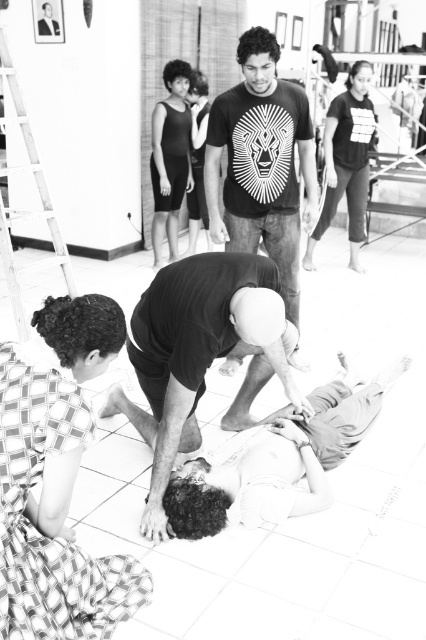
Who is positioned more to the left, checkered fabric at lower left or matte black t-shirt at center?

checkered fabric at lower left

Locate an element on the screen. checkered fabric at lower left is located at coordinates (57, 483).

Does matte black t-shirt at center have a greater height compared to dark gray t-shirt at upper right?

Correct, matte black t-shirt at center is much taller as dark gray t-shirt at upper right.

Who is positioned more to the right, matte black t-shirt at center or dark gray t-shirt at upper right?

Positioned to the right is dark gray t-shirt at upper right.

I want to click on matte black t-shirt at center, so click(261, 163).

Is checkered fabric at lower left behind smooth skin person at lower center?

No, it is in front of smooth skin person at lower center.

Does checkered fabric at lower left have a lesser height compared to smooth skin person at lower center?

No.

Does point (85, 294) lie behind point (252, 472)?

No.

You are a GUI agent. You are given a task and a screenshot of the screen. Output one action in this format:
    pyautogui.click(x=<x>, y=<y>)
    Task: Click on the checkered fabric at lower left
    The image size is (426, 640).
    Given the screenshot: What is the action you would take?
    pyautogui.click(x=57, y=483)